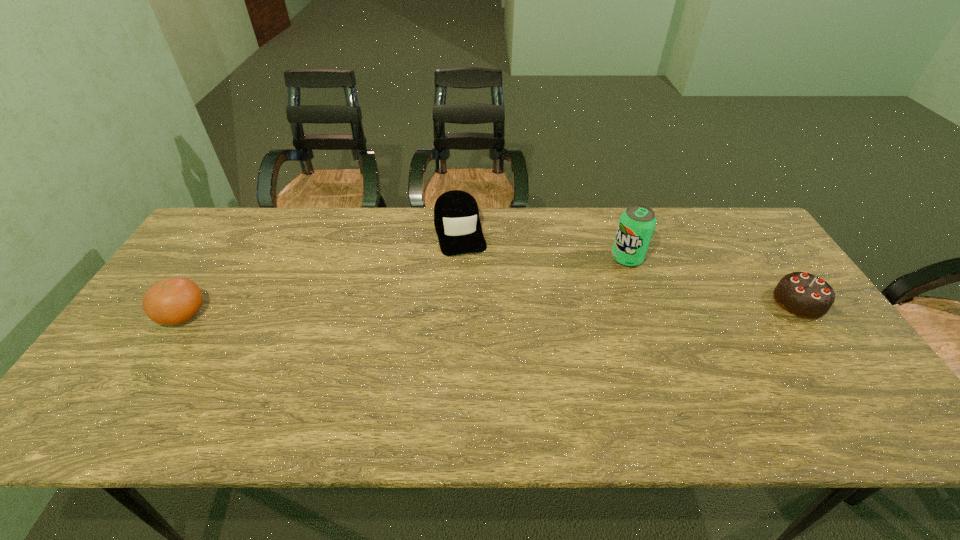
In the image, there is a desktop. Identify the location of free space at the far left corner. This screenshot has height=540, width=960. (236, 242).

You are a GUI agent. You are given a task and a screenshot of the screen. Output one action in this format:
    pyautogui.click(x=<x>, y=<y>)
    Task: Click on the vacant space at the near left corner
    The height and width of the screenshot is (540, 960).
    Given the screenshot: What is the action you would take?
    pyautogui.click(x=115, y=395)

This screenshot has height=540, width=960. Identify the location of vacant space at the far right corner. (747, 251).

This screenshot has height=540, width=960. I want to click on blank region between the tallest object and the cap, so click(x=543, y=244).

This screenshot has width=960, height=540. Identify the location of free space that is in between the leftmost object and the pop soda. (405, 286).

Locate an element on the screen. free space that is in between the cap and the leftmost object is located at coordinates (322, 272).

Find the location of a particular element. This screenshot has height=540, width=960. free space between the second object from right to left and the third object from right to left is located at coordinates (543, 244).

In order to click on free area in between the chocolate cake and the pop soda in this screenshot , I will do `click(713, 280)`.

Image resolution: width=960 pixels, height=540 pixels. Identify the location of free space between the clementine and the tallest object. (405, 286).

Locate an element on the screen. This screenshot has width=960, height=540. free spot between the tallest object and the cap is located at coordinates (543, 244).